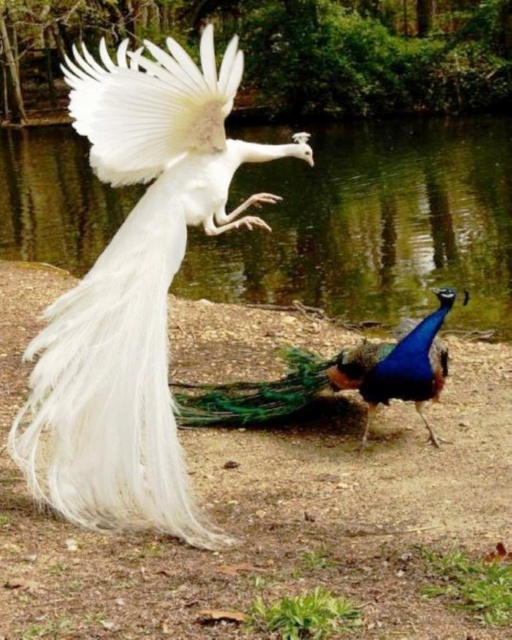
Between point (182, 88) and point (361, 156), which one is positioned behind?

Positioned behind is point (361, 156).

From the picture: Between white feathered peacock at center and transparent water at center, which one appears on the right side from the viewer's perspective?

From the viewer's perspective, transparent water at center appears more on the right side.

Does point (193, 64) come closer to viewer compared to point (407, 132)?

Yes, it is in front of point (407, 132).

The width and height of the screenshot is (512, 640). Find the location of `white feathered peacock at center`. white feathered peacock at center is located at coordinates (135, 291).

Is white feathered peacock at center wider than blue glossy peacock at center?

In fact, white feathered peacock at center might be narrower than blue glossy peacock at center.

Can you confirm if white feathered peacock at center is smaller than blue glossy peacock at center?

Actually, white feathered peacock at center might be larger than blue glossy peacock at center.

You are a GUI agent. You are given a task and a screenshot of the screen. Output one action in this format:
    pyautogui.click(x=<x>, y=<y>)
    Task: Click on the white feathered peacock at center
    The height and width of the screenshot is (640, 512).
    Given the screenshot: What is the action you would take?
    pyautogui.click(x=135, y=291)

Consider the image. Is transparent water at center to the left of blue glossy peacock at center from the viewer's perspective?

Answer: Incorrect, transparent water at center is not on the left side of blue glossy peacock at center.

Which is below, transparent water at center or blue glossy peacock at center?

Positioned lower is blue glossy peacock at center.

Is point (397, 152) positioned before point (294, 381)?

No, it is behind (294, 381).

You are a GUI agent. You are given a task and a screenshot of the screen. Output one action in this format:
    pyautogui.click(x=<x>, y=<y>)
    Task: Click on the transparent water at center
    
    Given the screenshot: What is the action you would take?
    pyautogui.click(x=374, y=225)